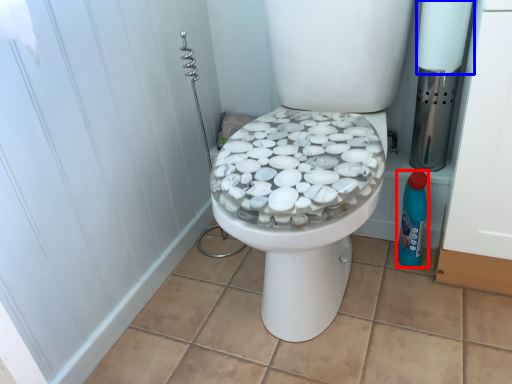
Question: Which of the following is the farthest to the observer, cleaning product (highlighted by a red box) or toilet paper (highlighted by a blue box)?

Choices:
 (A) cleaning product
 (B) toilet paper

Answer: (A)